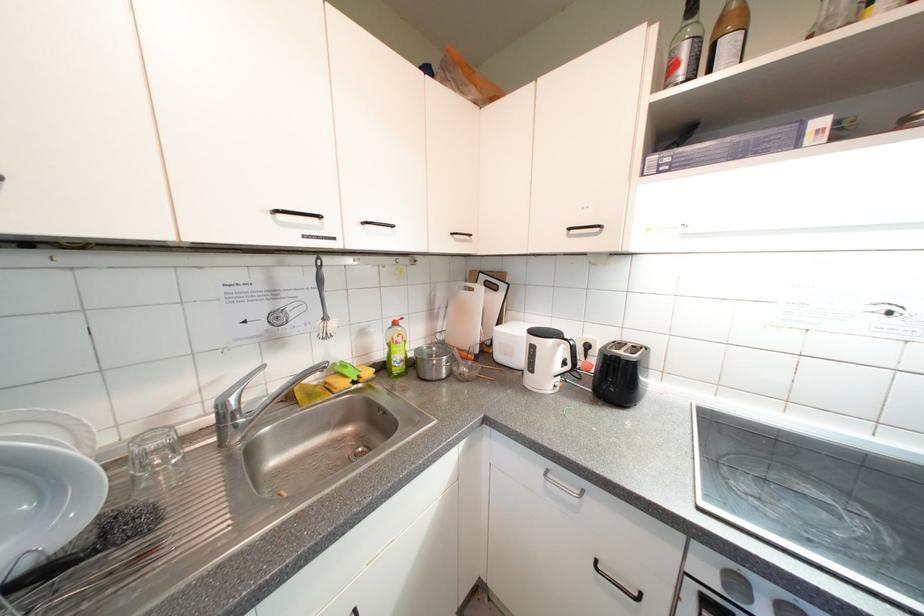
Where would you lift the glass cup? Please return your answer as a coordinate pair (x, y).

(153, 450)